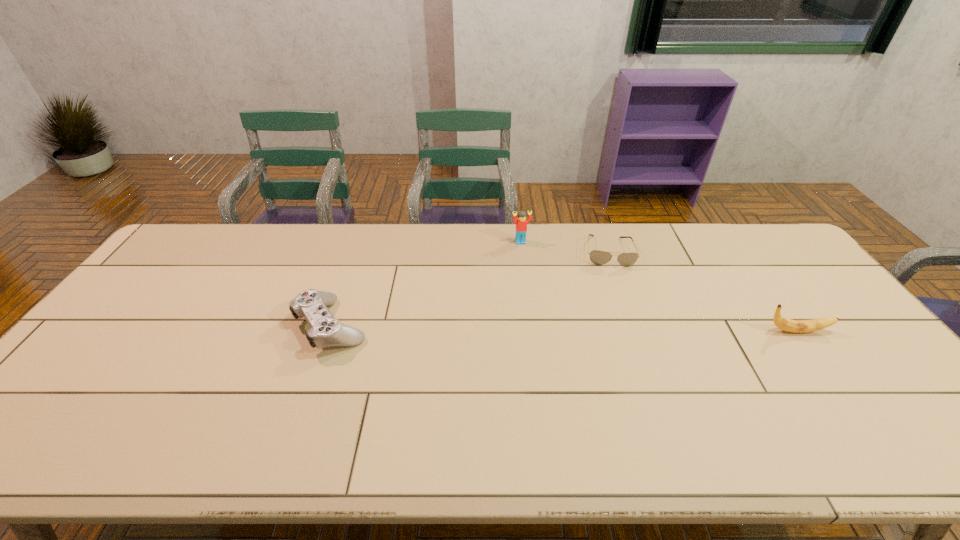
This screenshot has width=960, height=540. In order to click on free space located 0.130m on the face of the tallest object in this screenshot , I will do `click(530, 268)`.

At what (x,y) coordinates should I click in order to perform the action: click on vacant region located 0.220m on the face of the tallest object. Please return your answer as a coordinate pair (x, y). Looking at the image, I should click on (536, 287).

At what (x,y) coordinates should I click in order to perform the action: click on free space located 0.050m on the face of the tallest object. Please return your answer as a coordinate pair (x, y). This screenshot has height=540, width=960. Looking at the image, I should click on (525, 253).

At what (x,y) coordinates should I click in order to perform the action: click on vacant area located on the front-facing side of the shortest object. Please return your answer as a coordinate pair (x, y). The image size is (960, 540). Looking at the image, I should click on (622, 330).

I want to click on vacant position located on the front-facing side of the shortest object, so click(619, 317).

You are a GUI agent. You are given a task and a screenshot of the screen. Output one action in this format:
    pyautogui.click(x=<x>, y=<y>)
    Task: Click on the vacant position located 0.220m on the front-facing side of the shortest object
    This screenshot has width=960, height=540.
    Given the screenshot: What is the action you would take?
    pyautogui.click(x=619, y=317)

Locate an element on the screen. Lego at the far edge is located at coordinates (521, 223).

In order to click on sunglasses that is at the far edge in this screenshot , I will do `click(597, 257)`.

What are the coordinates of `object located at the right edge` in the screenshot? It's located at (796, 326).

The image size is (960, 540). In the image, there is a desktop. In order to click on vacant space at the far edge in this screenshot , I will do 576,245.